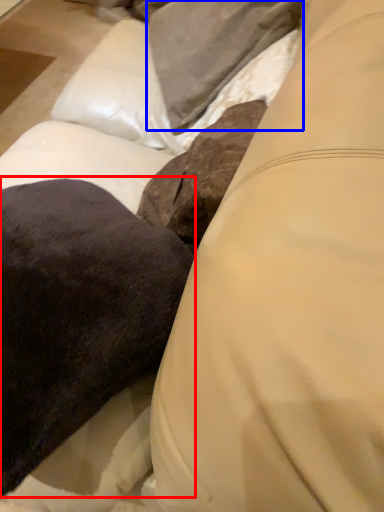
Question: Which object appears closest to the camera in this image, throw pillow (highlighted by a red box) or pillow (highlighted by a blue box)?

Choices:
 (A) throw pillow
 (B) pillow

Answer: (A)